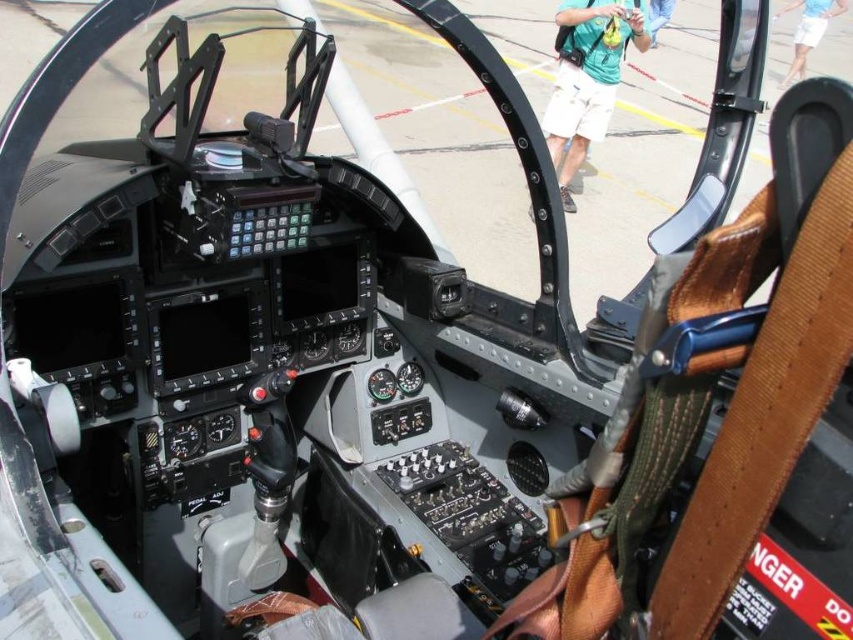
Question: Is green fabric backpack at upper center bigger than blue cotton shirt at upper right?

Choices:
 (A) no
 (B) yes

Answer: (A)

Question: Does green fabric backpack at upper center have a larger size compared to blue cotton shirt at upper right?

Choices:
 (A) yes
 (B) no

Answer: (B)

Question: Among these objects, which one is nearest to the camera?

Choices:
 (A) green fabric backpack at upper center
 (B) blue cotton shirt at upper right

Answer: (A)

Question: Which point is farther to the camera?

Choices:
 (A) (553, 136)
 (B) (813, 22)

Answer: (B)

Question: Can you confirm if green fabric backpack at upper center is wider than blue cotton shirt at upper right?

Choices:
 (A) no
 (B) yes

Answer: (A)

Question: Which of the following is the farthest from the observer?

Choices:
 (A) green fabric backpack at upper center
 (B) blue cotton shirt at upper right

Answer: (B)